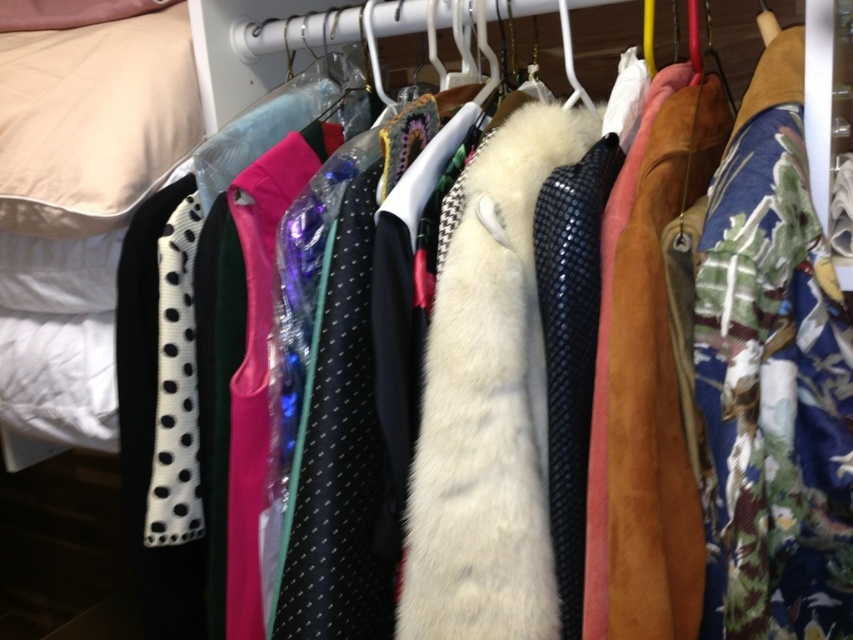
You are standing in front of a closet with garments hanging on a white metal rack. You notice two points marked on the rack at coordinates point (785, 81) and point (416, 515). If you want to reach the point that is closer to you, which one should you aim for?

Point (416, 515) is closer to you because it is less further than point (785, 81), which is further away.

You are organizing a closet and need to place a new garment that is 24 inches wide. There is a space between the floral fabric dress at right and the fur vest in the center. Can the new garment fit in that space?

The space between the floral fabric dress at right and the fur vest in the center is 22.53 inches. Since the new garment is 24 inches wide, it cannot fit in the available space.

You are organizing the closet and need to place a new accessory between the floral fabric dress at right and the white fabric pillow at upper left. Based on their positions, where should you place the accessory?

The floral fabric dress at right is located below the white fabric pillow at upper left, so you should place the accessory between them either above the dress or below the pillow to ensure it fits in the space between them.